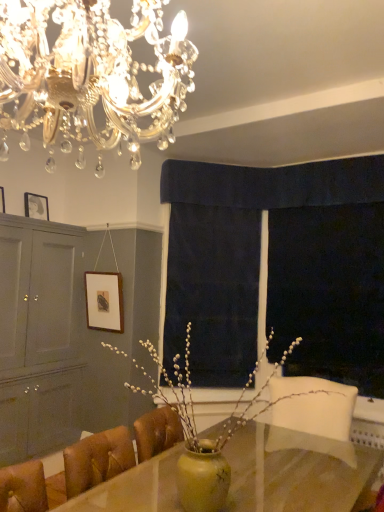
Measure the distance between matte gray cabinet at left and camera.

The depth of matte gray cabinet at left is 10.57 feet.

The height and width of the screenshot is (512, 384). What do you see at coordinates (90, 74) in the screenshot? I see `crystal chandelier at upper center` at bounding box center [90, 74].

Image resolution: width=384 pixels, height=512 pixels. What are the coordinates of `wooden picture frame at upper left, the first picture frame viewed from the right` in the screenshot? It's located at (104, 301).

What are the coordinates of `matte gray cabinet at left` in the screenshot? It's located at (39, 336).

Can you tell me how much matte gray cabinet at left and yellow glossy vase at center differ in facing direction?

90.2 degrees separate the facing orientations of matte gray cabinet at left and yellow glossy vase at center.

Looking at this image, from the image's perspective, relative to yellow glossy vase at center, is matte gray cabinet at left above or below?

From the image's perspective, matte gray cabinet at left appears above yellow glossy vase at center.

Would you say matte gray cabinet at left is a long distance from yellow glossy vase at center?

Yes, matte gray cabinet at left and yellow glossy vase at center are quite far apart.

Is point (37, 194) closer or farther from the camera than point (185, 329)?

Point (37, 194) appears to be farther away from the viewer than point (185, 329).

Between matte black picture frame at upper left, the 2th picture frame from the bottom, and dark blue velvet curtain at center, the 2th curtain from the top, which one has less height?

Standing shorter between the two is matte black picture frame at upper left, the 2th picture frame from the bottom.

From a real-world perspective, which object rests below the other?

dark blue velvet curtain at center, the second curtain positioned from the right, from a real-world perspective.

Is matte black picture frame at upper left, the 2th picture frame positioned from the top, to the left of dark blue velvet curtain at center, the 1th curtain when ordered from bottom to top, from the viewer's perspective?

Yes, matte black picture frame at upper left, the 2th picture frame positioned from the top, is to the left of dark blue velvet curtain at center, the 1th curtain when ordered from bottom to top.

Can you confirm if yellow glossy vase at center is smaller than yellow matte vase at center?

No.

Consider the image. Between yellow glossy vase at center and yellow matte vase at center, which one has larger width?

yellow glossy vase at center is wider.

How different are the orientations of yellow glossy vase at center and yellow matte vase at center in degrees?

The angular difference between yellow glossy vase at center and yellow matte vase at center is 2.82 degrees.

Would you say yellow glossy vase at center is a long distance from yellow matte vase at center?

yellow glossy vase at center is positioned a significant distance from yellow matte vase at center.

Relative to wooden picture frame at upper left, which is the 3th picture frame in bottom-to-top order, is crystal chandelier at upper center in front or behind?

crystal chandelier at upper center is in front of wooden picture frame at upper left, which is the 3th picture frame in bottom-to-top order.

Looking at this image, from a real-world perspective, which is physically below, crystal chandelier at upper center or wooden picture frame at upper left, positioned as the 1th picture frame in left-to-right order?

In real-world perspective, wooden picture frame at upper left, positioned as the 1th picture frame in left-to-right order, is lower.

There is a wooden picture frame at upper left, positioned as the 1th picture frame in left-to-right order. Where is `chandelier above it (from a real-world perspective)`? The width and height of the screenshot is (384, 512). chandelier above it (from a real-world perspective) is located at coordinates (90, 74).

Which is more to the right, crystal chandelier at upper center or wooden picture frame at upper left, acting as the 1th picture frame starting from the top?

From the viewer's perspective, crystal chandelier at upper center appears more on the right side.

At what (x,y) coordinates should I click in order to perform the action: click on curtain on the right side of yellow glossy vase at center. Please return your answer as a coordinate pair (x, y). The image size is (384, 512). Looking at the image, I should click on coord(274,183).

How many degrees apart are the facing directions of yellow glossy vase at center and dark blue velvet curtain at upper center, marked as the 1th curtain in a right-to-left arrangement?

The angular difference between yellow glossy vase at center and dark blue velvet curtain at upper center, marked as the 1th curtain in a right-to-left arrangement, is 0.393 degrees.

From the image's perspective, does yellow glossy vase at center appear higher than dark blue velvet curtain at upper center, acting as the first curtain starting from the top?

No, from the image's perspective, yellow glossy vase at center is not above dark blue velvet curtain at upper center, acting as the first curtain starting from the top.

Would you consider yellow glossy vase at center to be distant from dark blue velvet curtain at upper center, the 2th curtain viewed from the left?

Indeed, yellow glossy vase at center is not near dark blue velvet curtain at upper center, the 2th curtain viewed from the left.

Is crystal chandelier at upper center aimed at dark blue velvet curtain at upper center, acting as the first curtain starting from the top?

No, crystal chandelier at upper center is not aimed at dark blue velvet curtain at upper center, acting as the first curtain starting from the top.

Are crystal chandelier at upper center and dark blue velvet curtain at upper center, the 2th curtain viewed from the left, beside each other?

No, crystal chandelier at upper center is not beside dark blue velvet curtain at upper center, the 2th curtain viewed from the left.

Considering the points (138, 89) and (165, 187), which point is behind, point (138, 89) or point (165, 187)?

Point (165, 187)

Is wooden picture frame at upper left, the third picture frame viewed from the top, oriented towards yellow matte vase at center?

No, wooden picture frame at upper left, the third picture frame viewed from the top, does not turn towards yellow matte vase at center.

Which object is positioned more to the right, wooden picture frame at upper left, the first picture frame viewed from the right, or yellow matte vase at center?

yellow matte vase at center is more to the right.

Is wooden picture frame at upper left, acting as the 1th picture frame starting from the bottom, bigger than yellow matte vase at center?

No, wooden picture frame at upper left, acting as the 1th picture frame starting from the bottom, is not bigger than yellow matte vase at center.

Locate an element on the screen. cabinetry above the yellow glossy vase at center (from a real-world perspective) is located at coordinates coord(39,336).

Identify the location of the 1st picture frame in front when counting from the dark blue velvet curtain at center, the 2th curtain from the top. The image size is (384, 512). (36, 206).

Estimate the real-world distances between objects in this image. Which object is closer to transparent plastic screen at right, wooden picture frame at upper left, positioned as the 1th picture frame in left-to-right order, or matte black picture frame at upper left, placed as the second picture frame when sorted from right to left?

matte black picture frame at upper left, placed as the second picture frame when sorted from right to left, is closer to transparent plastic screen at right.

When comparing their distances from crystal chandelier at upper center, does yellow glossy vase at center or yellow matte vase at center seem closer?

Among the two, yellow glossy vase at center is located nearer to crystal chandelier at upper center.

From the image, which object appears to be nearer to dark blue velvet curtain at upper center, the 2th curtain viewed from the left, transparent plastic screen at right or wooden picture frame at upper left, the third picture frame in the left-to-right sequence?

transparent plastic screen at right lies closer to dark blue velvet curtain at upper center, the 2th curtain viewed from the left, than the other object.

When comparing their distances from transparent plastic screen at right, does dark blue velvet curtain at upper center, the 2th curtain viewed from the left, or crystal chandelier at upper center seem closer?

dark blue velvet curtain at upper center, the 2th curtain viewed from the left.

Based on their spatial positions, is dark blue velvet curtain at upper center, acting as the first curtain starting from the top, or yellow glossy vase at center closer to matte gray cabinet at left?

dark blue velvet curtain at upper center, acting as the first curtain starting from the top, is positioned closer to the anchor matte gray cabinet at left.

Estimate the real-world distances between objects in this image. Which object is closer to crystal chandelier at upper center, dark blue velvet curtain at upper center, the second curtain when ordered from bottom to top, or wooden picture frame at upper left, the 3th picture frame in the right-to-left sequence?

dark blue velvet curtain at upper center, the second curtain when ordered from bottom to top, is closer to crystal chandelier at upper center.

Which object lies nearer to the anchor point transparent plastic screen at right, dark blue velvet curtain at upper center, marked as the 1th curtain in a right-to-left arrangement, or yellow matte vase at center?

Among the two, dark blue velvet curtain at upper center, marked as the 1th curtain in a right-to-left arrangement, is located nearer to transparent plastic screen at right.

From the image, which object appears to be nearer to matte black picture frame at upper left, the 2th picture frame positioned from the top, wooden picture frame at upper left, the third picture frame in the left-to-right sequence, or yellow glossy vase at center?

Based on the image, wooden picture frame at upper left, the third picture frame in the left-to-right sequence, appears to be nearer to matte black picture frame at upper left, the 2th picture frame positioned from the top.

I want to click on cabinetry between yellow matte vase at center and dark blue velvet curtain at upper center, marked as the 1th curtain in a right-to-left arrangement, along the z-axis, so click(39, 336).

What are the coordinates of `table positioned between yellow matte vase at center and matte gray cabinet at left from near to far` in the screenshot? It's located at [294, 476].

Locate an element on the screen. The image size is (384, 512). cabinetry between matte black picture frame at upper left, positioned as the second picture frame in left-to-right order, and transparent plastic screen at right from left to right is located at coordinates (39, 336).

Where is `picture frame situated between matte black picture frame at upper left, positioned as the second picture frame in left-to-right order, and dark blue velvet curtain at center, the 1th curtain from the left, from left to right`? The width and height of the screenshot is (384, 512). picture frame situated between matte black picture frame at upper left, positioned as the second picture frame in left-to-right order, and dark blue velvet curtain at center, the 1th curtain from the left, from left to right is located at coordinates (104, 301).